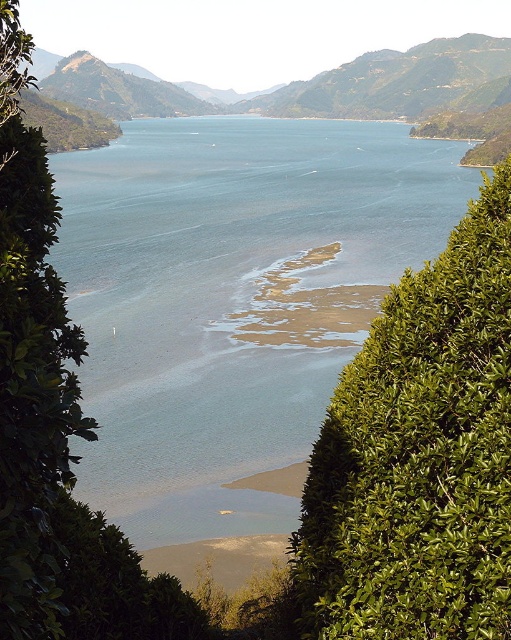
Is clear blue water at center further to the viewer compared to green leafy bush at center?

Yes, it is behind green leafy bush at center.

Is clear blue water at center shorter than green leafy bush at center?

No, clear blue water at center is not shorter than green leafy bush at center.

Where is `clear blue water at center`? clear blue water at center is located at coordinates (233, 300).